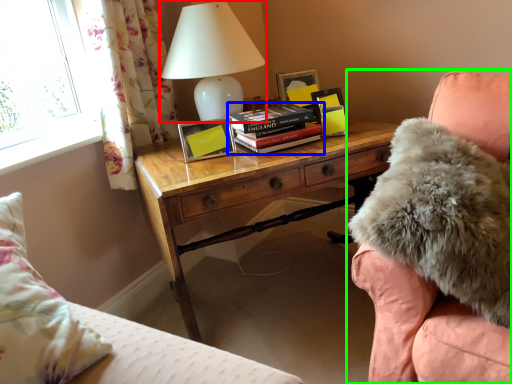
Question: Considering the real-world distances, which object is farthest from table lamp (highlighted by a red box)? book (highlighted by a blue box) or chair (highlighted by a green box)?

Choices:
 (A) book
 (B) chair

Answer: (B)